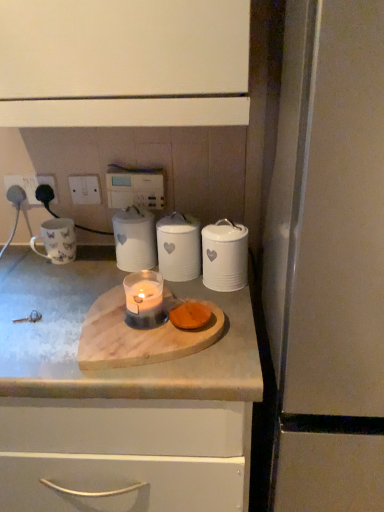
This screenshot has width=384, height=512. What are the coordinates of `vacant space positioned to the left of wooden cutting board at center` in the screenshot? It's located at (36, 317).